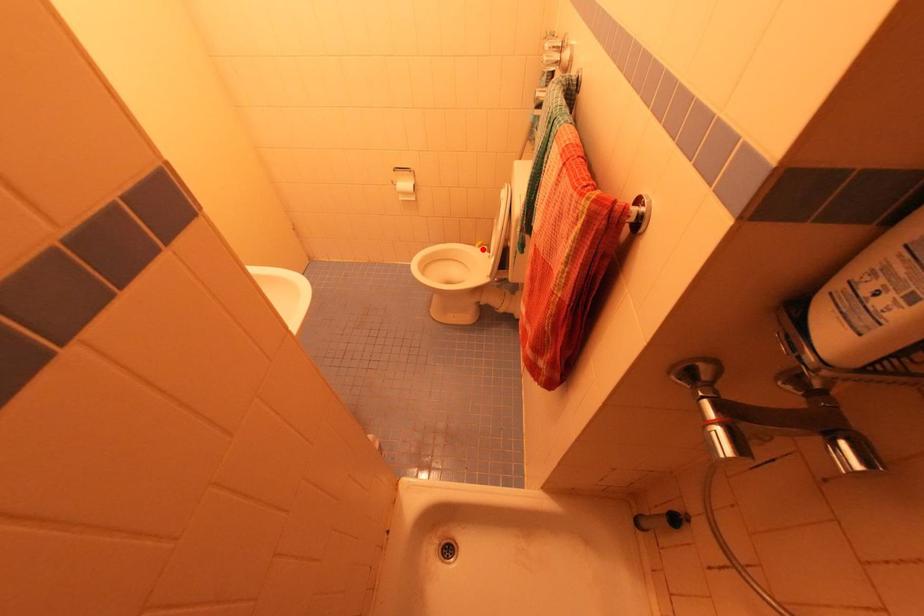
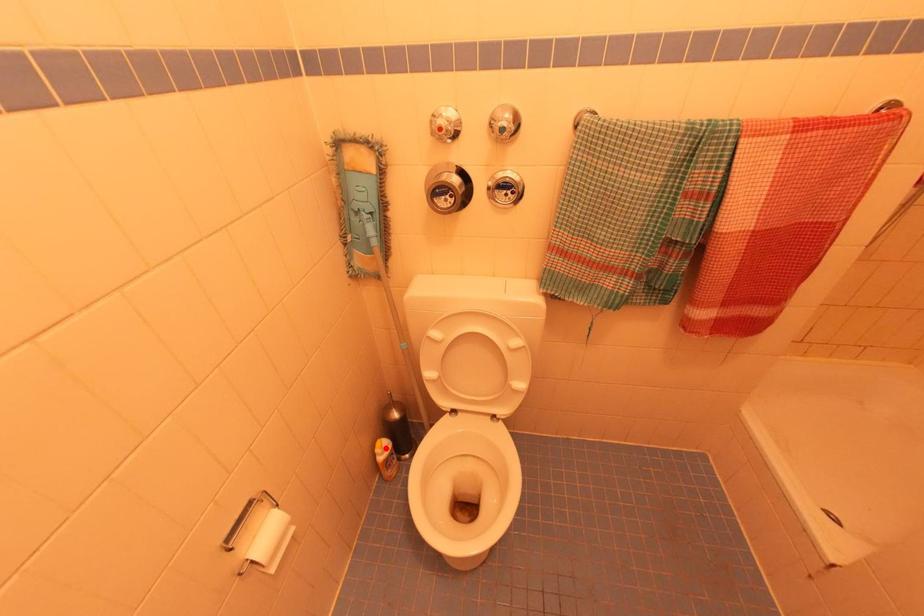
I am providing you with two images of the same scene from different viewpoints. A red point is marked on the first image and another point is marked on the second image. Is the red point in image1 aligned with the point shown in image2?

Yes